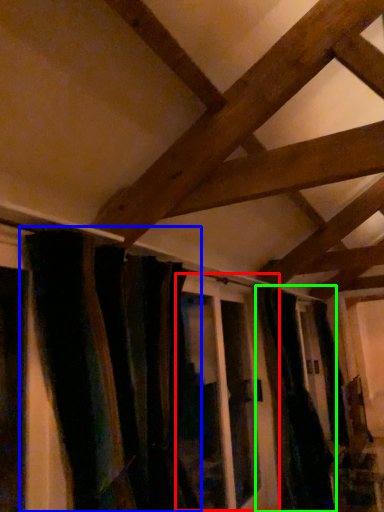
Question: Which object is the closest to the screen door (highlighted by a red box)? Choose among these: curtain (highlighted by a blue box) or curtain (highlighted by a green box).

Choices:
 (A) curtain
 (B) curtain

Answer: (B)